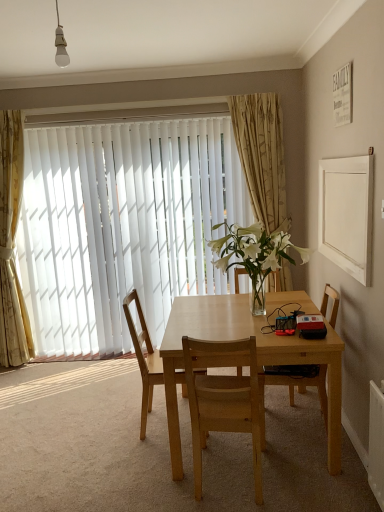
In order to click on free space in front of light wood chair at center, placed as the 3th chair when sorted from right to left in this screenshot , I will do `click(144, 465)`.